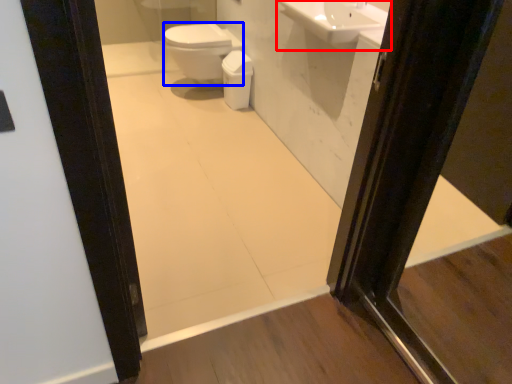
Question: Among these objects, which one is farthest to the camera, sink (highlighted by a red box) or bidet (highlighted by a blue box)?

Choices:
 (A) sink
 (B) bidet

Answer: (B)